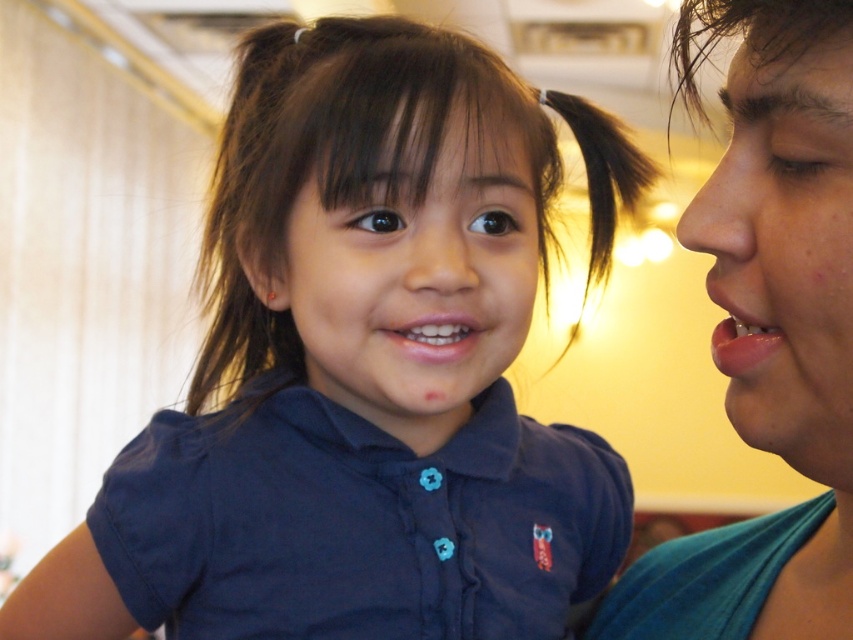
Who is more forward, (123, 483) or (611, 188)?

Point (123, 483)

Does navy blue cotton shirt at center have a smaller size compared to black silky hair at upper center?

Incorrect, navy blue cotton shirt at center is not smaller in size than black silky hair at upper center.

Is point (514, 406) positioned behind point (538, 100)?

Yes, it is behind point (538, 100).

I want to click on navy blue cotton shirt at center, so click(x=358, y=522).

The image size is (853, 640). Describe the element at coordinates (358, 522) in the screenshot. I see `navy blue cotton shirt at center` at that location.

Consider the image. Between navy blue cotton shirt at center and pink glossy lips at right, which one appears on the left side from the viewer's perspective?

navy blue cotton shirt at center is more to the left.

Who is more distant from viewer, (x=223, y=550) or (x=744, y=358)?

The point (x=223, y=550) is behind.

Identify the location of navy blue cotton shirt at center. The height and width of the screenshot is (640, 853). (358, 522).

Can you confirm if dark brown silky hair at upper right is taller than pink glossy lips at right?

Correct, dark brown silky hair at upper right is much taller as pink glossy lips at right.

Does dark brown silky hair at upper right have a lesser width compared to pink glossy lips at right?

No, dark brown silky hair at upper right is not thinner than pink glossy lips at right.

Does point (717, 26) come farther from viewer compared to point (727, 321)?

No, (717, 26) is closer to viewer.

I want to click on dark brown silky hair at upper right, so click(x=747, y=35).